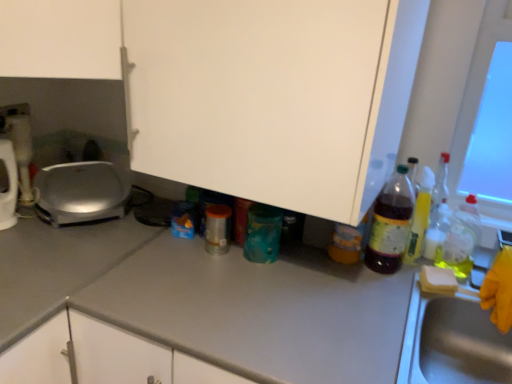
I want to click on vacant area located to the right-hand side of metallic silver can at center, which appears as the 1th bottle when viewed from the left, so click(x=273, y=262).